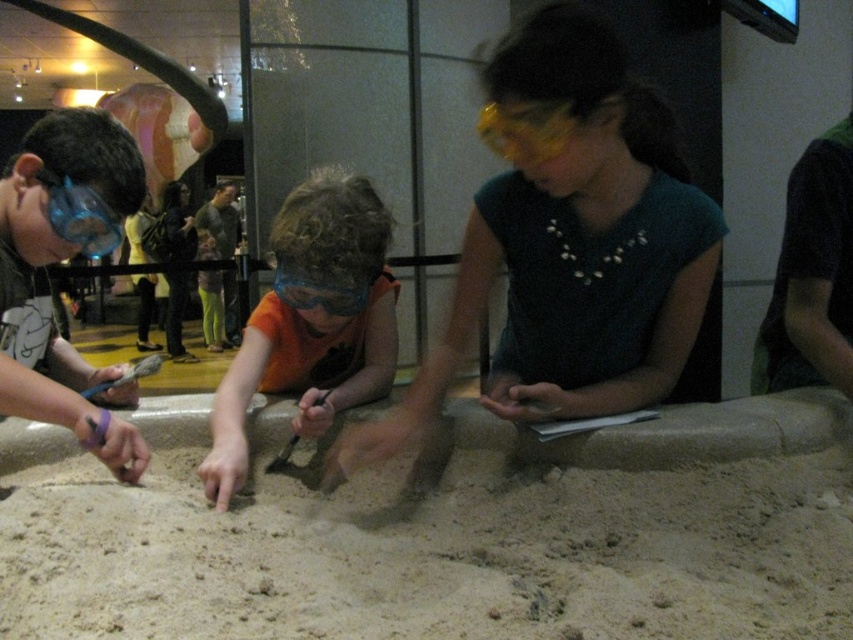
Can you confirm if orange fabric shirt at center is positioned to the right of transparent blue goggles at left?

Yes, orange fabric shirt at center is to the right of transparent blue goggles at left.

Identify the location of orange fabric shirt at center. (311, 321).

Can you confirm if fine-grained sand at center is wider than orange fabric shirt at center?

Yes.

Between fine-grained sand at center and orange fabric shirt at center, which one is positioned higher?

Positioned higher is orange fabric shirt at center.

Does point (834, 534) lie behind point (370, 257)?

No, (834, 534) is in front of (370, 257).

Locate an element on the screen. The height and width of the screenshot is (640, 853). fine-grained sand at center is located at coordinates (444, 532).

Does fine-grained sand at center appear over transparent blue goggles at left?

No, fine-grained sand at center is not above transparent blue goggles at left.

Can you confirm if fine-grained sand at center is smaller than transparent blue goggles at left?

No, fine-grained sand at center is not smaller than transparent blue goggles at left.

Is point (245, 620) positioned after point (88, 256)?

No, it is in front of (88, 256).

Locate an element on the screen. Image resolution: width=853 pixels, height=640 pixels. fine-grained sand at center is located at coordinates (444, 532).